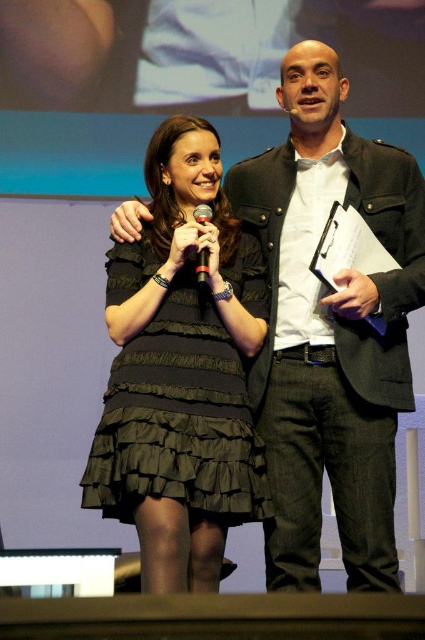
You are an event planner trying to place a decorative banner on the stage. The banner must be placed directly above the matte black jacket at center. What coordinates should you use to position the banner?

The banner should be placed at coordinates approximately 0.514 in the x and 0.779 in the y direction to be directly above the matte black jacket at center.

You are a photographer setting up for a presentation. You need to ensure that both the matte black jacket at center and the black textured dress at center are visible in your shot. Given their heights, which one might require you to adjust your camera angle to avoid being cut off?

The matte black jacket at center is much taller than the black textured dress at center, so the matte black jacket at center might require adjusting the camera angle to avoid being cut off due to its greater height.

You are a photographer setting up for a presentation. You need to ensure that both the matte black jacket at center and the black textured dress at center are fully visible in your shot. Given that your camera frame can only accommodate objects up to the width of the wider object, which object determines the minimum required frame width?

The matte black jacket at center has a greater width than the black textured dress at center. Therefore, the minimum required frame width should be determined by the matte black jacket at center to ensure both are fully visible.